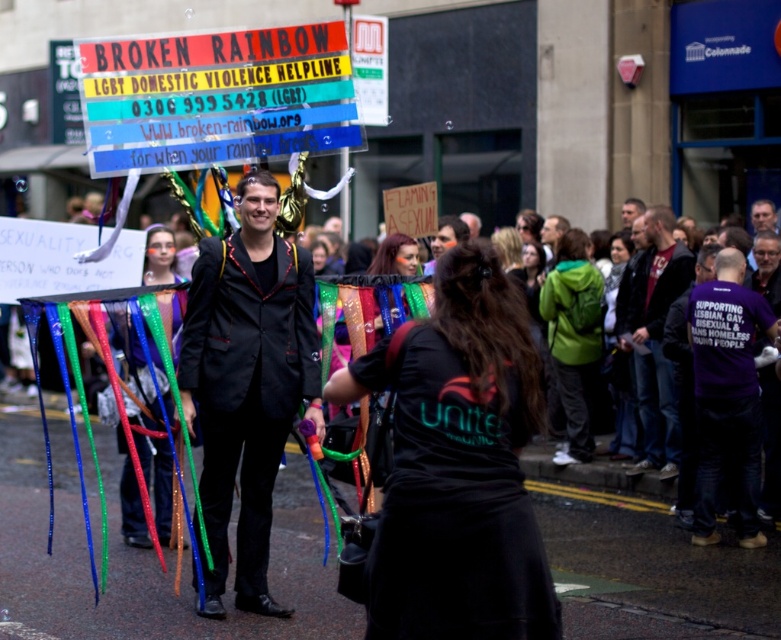
Question: Is purple fabric shirt at center-right thinner than matte black jacket at center?

Choices:
 (A) no
 (B) yes

Answer: (A)

Question: Which object appears farthest from the camera in this image?

Choices:
 (A) satin black suit at center
 (B) purple fabric shirt at center-right
 (C) matte black jacket at center

Answer: (C)

Question: Does satin black suit at center have a smaller size compared to shiny sequined ribbons at center?

Choices:
 (A) yes
 (B) no

Answer: (B)

Question: Which point is closer to the camera?

Choices:
 (A) purple fabric shirt at center-right
 (B) green matte jacket at center
 (C) satin black suit at center
 (D) black matte shirt at center

Answer: (D)

Question: Does green matte jacket at center appear under green fabric jacket at center?

Choices:
 (A) no
 (B) yes

Answer: (B)

Question: Among these objects, which one is nearest to the camera?

Choices:
 (A) matte black jacket at center
 (B) green matte jacket at center

Answer: (B)